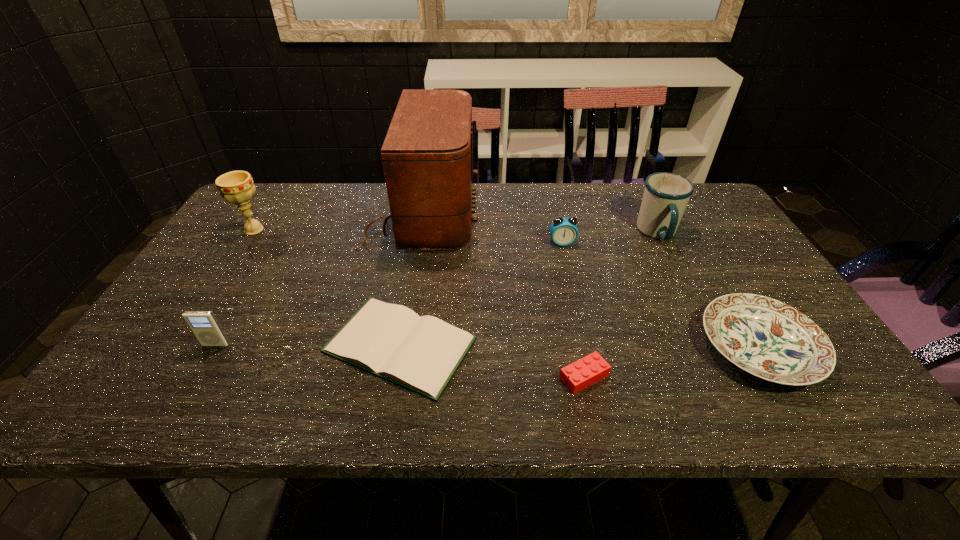
Where is `free space located on the back of the leftmost object`? The width and height of the screenshot is (960, 540). free space located on the back of the leftmost object is located at coordinates (284, 183).

This screenshot has height=540, width=960. What are the coordinates of `free space located on the handle side of the mug` in the screenshot? It's located at (703, 321).

The image size is (960, 540). What are the coordinates of `free space located on the front-facing side of the iPod` in the screenshot? It's located at (195, 381).

The height and width of the screenshot is (540, 960). I want to click on vacant space positioned 0.260m on the face of the alarm clock, so click(578, 314).

This screenshot has height=540, width=960. I want to click on vacant space situated 0.090m on the back of the third shortest object, so click(719, 281).

Image resolution: width=960 pixels, height=540 pixels. I want to click on free location located 0.200m on the left of the seventh tallest object, so click(464, 376).

The image size is (960, 540). In order to click on vacant area located 0.240m on the left of the shortest object in this screenshot , I will do `click(216, 345)`.

Locate an element on the screen. The width and height of the screenshot is (960, 540). radio receiver located in the far edge section of the desktop is located at coordinates (427, 155).

I want to click on chalice located at the far edge, so click(x=237, y=187).

This screenshot has height=540, width=960. I want to click on mug that is at the far edge, so click(x=666, y=195).